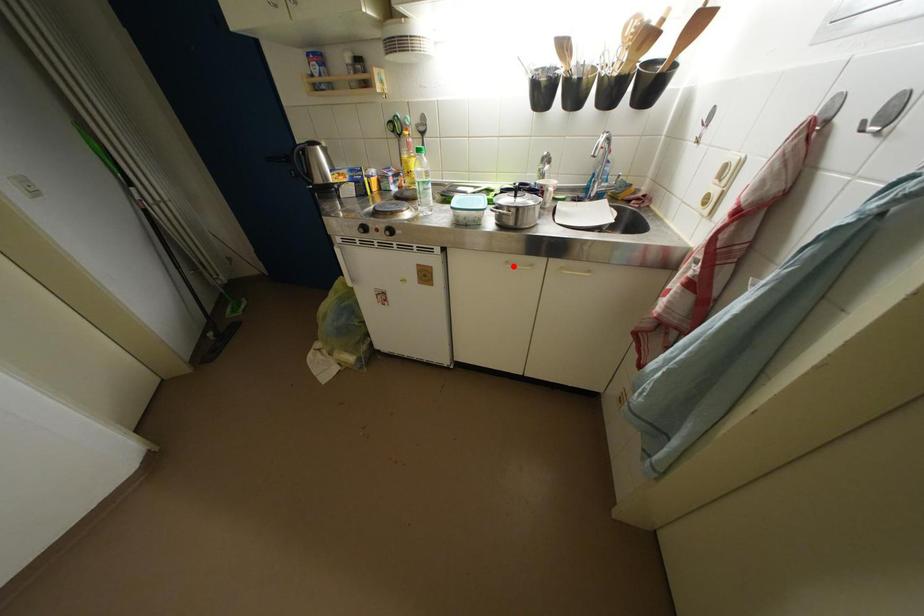
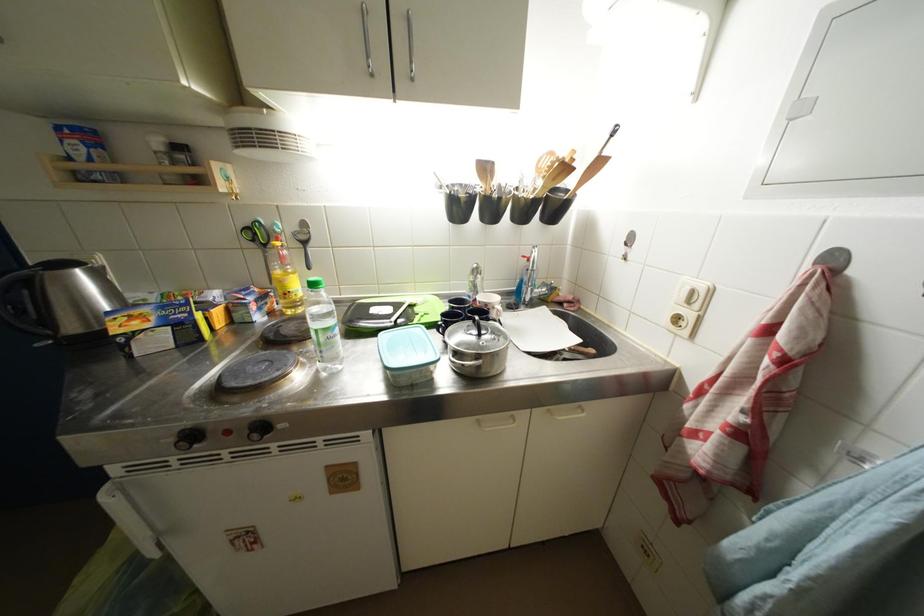
Find the pixel in the second image that matches the highlighted location in the first image.

(485, 424)